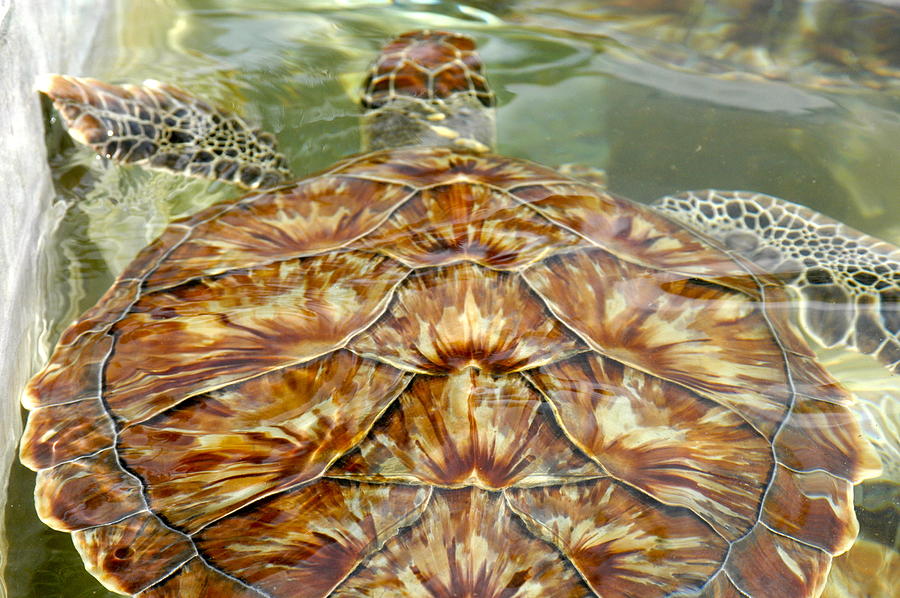
In order to click on painting in this screenshot , I will do `click(662, 422)`.